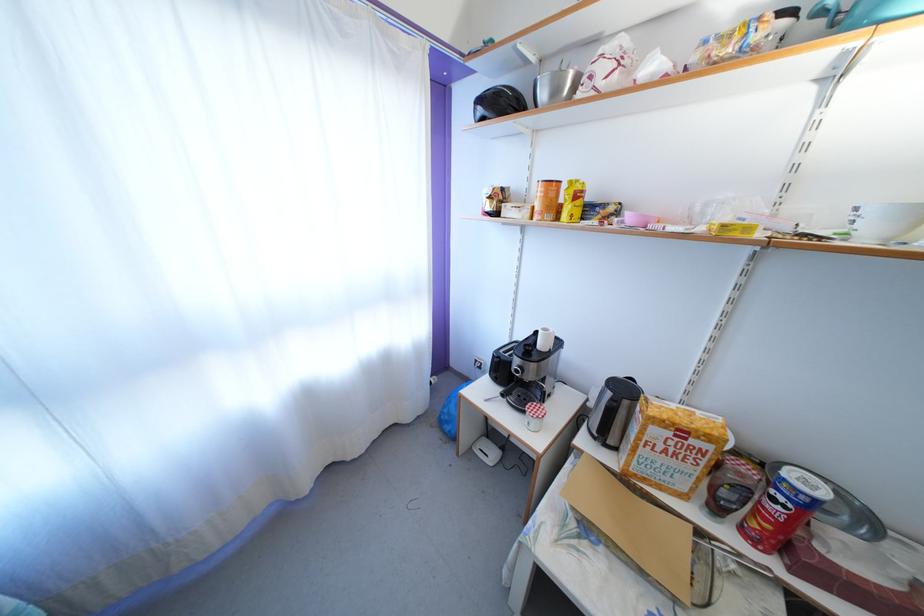
Image resolution: width=924 pixels, height=616 pixels. I want to click on coffee machine knob, so click(x=520, y=398).